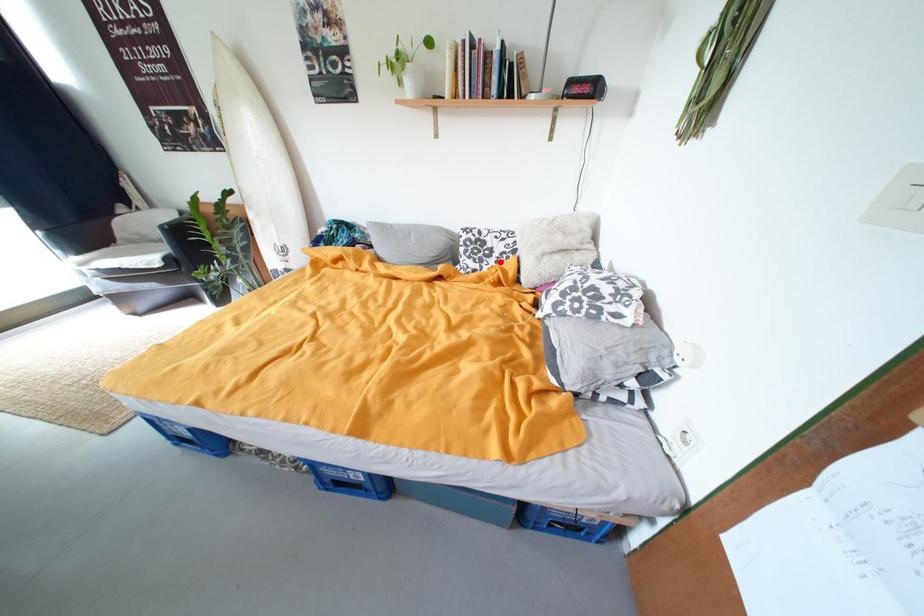
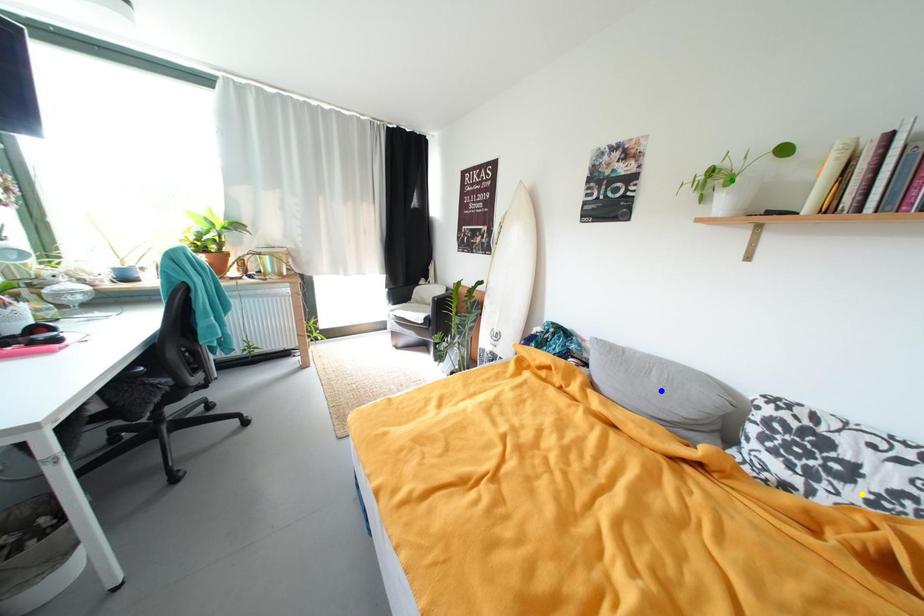
Question: I am providing you with two images of the same scene from different viewpoints. A red point is marked on the first image. You are given multiple points on the second image. Which mark in image 2 goes with the point in image 1?

Choices:
 (A) blue point
 (B) green point
 (C) yellow point

Answer: (C)